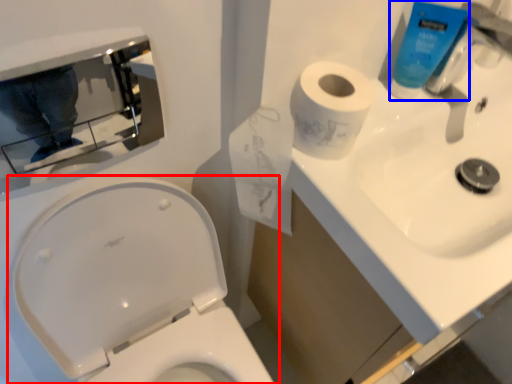
Question: Which of the following is the farthest to the observer, toilet (highlighted by a red box) or cleaning product (highlighted by a blue box)?

Choices:
 (A) toilet
 (B) cleaning product

Answer: (B)